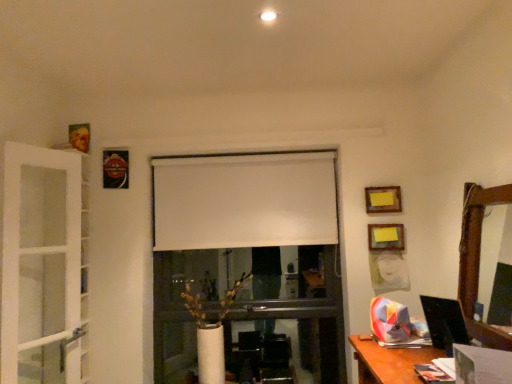
Question: Would you consider metallic reflective picture frame at upper left, which is the 1th picture frame from left to right, to be distant from yellow paper at upper center, the 3th picture frame when ordered from right to left?

Choices:
 (A) no
 (B) yes

Answer: (B)

Question: Can you confirm if metallic reflective picture frame at upper left, the fourth picture frame in the bottom-to-top sequence, is positioned to the right of yellow paper at upper center, the 2th picture frame when ordered from top to bottom?

Choices:
 (A) no
 (B) yes

Answer: (A)

Question: Considering the relative sizes of metallic reflective picture frame at upper left, the fourth picture frame in the bottom-to-top sequence, and yellow paper at upper center, the 3th picture frame when ordered from right to left, in the image provided, is metallic reflective picture frame at upper left, the fourth picture frame in the bottom-to-top sequence, taller than yellow paper at upper center, the 3th picture frame when ordered from right to left,?

Choices:
 (A) yes
 (B) no

Answer: (A)

Question: Considering the relative positions of metallic reflective picture frame at upper left, the fourth picture frame in the bottom-to-top sequence, and yellow paper at upper center, the 2th picture frame when ordered from top to bottom, in the image provided, is metallic reflective picture frame at upper left, the fourth picture frame in the bottom-to-top sequence, in front of yellow paper at upper center, the 2th picture frame when ordered from top to bottom,?

Choices:
 (A) yes
 (B) no

Answer: (B)

Question: Does metallic reflective picture frame at upper left, the fourth picture frame in the bottom-to-top sequence, appear on the left side of yellow paper at upper center, the 3th picture frame when ordered from right to left?

Choices:
 (A) no
 (B) yes

Answer: (B)

Question: Is metallic reflective picture frame at upper left, which appears as the 4th picture frame when viewed from the right, not within yellow paper at upper center, which is the third picture frame in bottom-to-top order?

Choices:
 (A) yes
 (B) no

Answer: (A)

Question: Is there a large distance between metallic reflective picture frame at upper left, which appears as the 4th picture frame when viewed from the right, and white glass screen door at left?

Choices:
 (A) no
 (B) yes

Answer: (A)

Question: Is metallic reflective picture frame at upper left, which is the 1th picture frame from left to right, shorter than white glass screen door at left?

Choices:
 (A) no
 (B) yes

Answer: (B)

Question: Is white glass screen door at left inside metallic reflective picture frame at upper left, which appears as the 4th picture frame when viewed from the right?

Choices:
 (A) no
 (B) yes

Answer: (A)

Question: Can you confirm if metallic reflective picture frame at upper left, the 1th picture frame positioned from the top, is positioned to the left of white glass screen door at left?

Choices:
 (A) yes
 (B) no

Answer: (B)

Question: Considering the relative sizes of metallic reflective picture frame at upper left, the fourth picture frame in the bottom-to-top sequence, and white glass screen door at left in the image provided, is metallic reflective picture frame at upper left, the fourth picture frame in the bottom-to-top sequence, bigger than white glass screen door at left?

Choices:
 (A) yes
 (B) no

Answer: (B)

Question: Is metallic reflective picture frame at upper left, which is the 1th picture frame from left to right, wider than white glass screen door at left?

Choices:
 (A) no
 (B) yes

Answer: (A)

Question: Is white matte curtain at center thinner than yellow paper at upper center, which ranks as the 2th picture frame in left-to-right order?

Choices:
 (A) yes
 (B) no

Answer: (B)